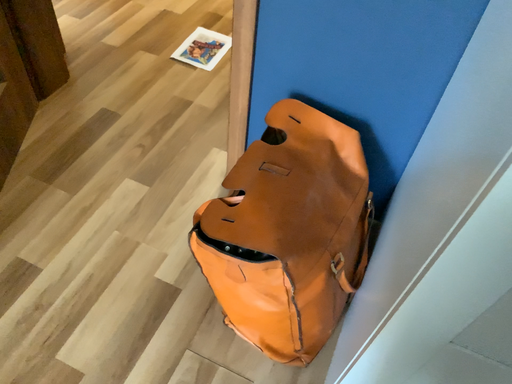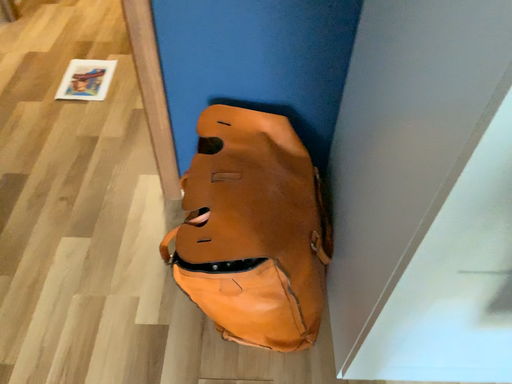
Question: How did the camera likely rotate when shooting the video?

Choices:
 (A) rotated left
 (B) rotated right

Answer: (B)